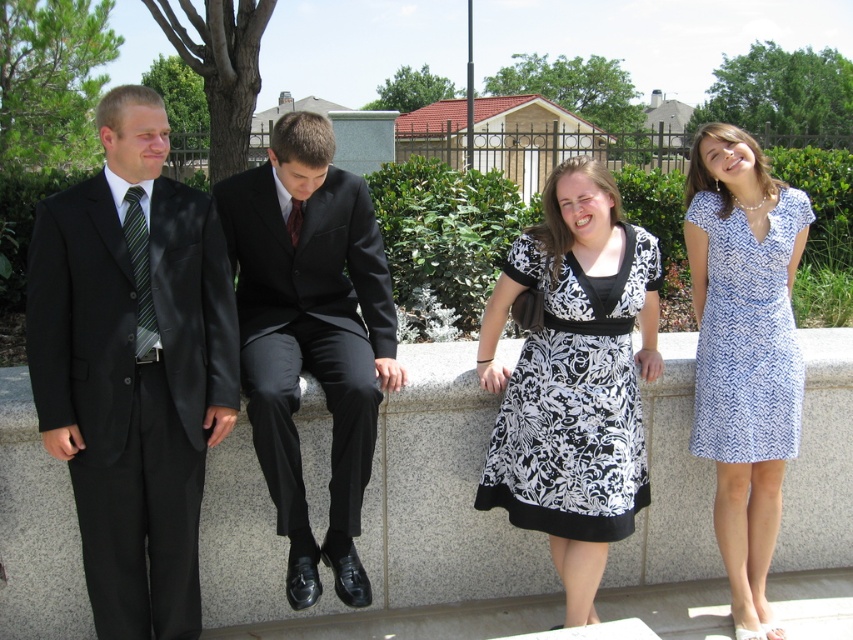
From the picture: Does blue zigzag-patterned dress at right appear on the left side of black silk tie at center?

In fact, blue zigzag-patterned dress at right is to the right of black silk tie at center.

From the picture: Does blue zigzag-patterned dress at right appear under black silk tie at center?

Indeed, blue zigzag-patterned dress at right is positioned under black silk tie at center.

At what (x,y) coordinates should I click in order to perform the action: click on blue zigzag-patterned dress at right. Please return your answer as a coordinate pair (x, y). This screenshot has height=640, width=853. Looking at the image, I should click on pyautogui.click(x=747, y=333).

Does green striped tie at left appear on the left side of black silk tie at center?

Correct, you'll find green striped tie at left to the left of black silk tie at center.

Looking at this image, who is higher up, green striped tie at left or black silk tie at center?

Positioned higher is black silk tie at center.

Locate an element on the screen. This screenshot has width=853, height=640. green striped tie at left is located at coordinates (140, 269).

Does point (579, 440) come in front of point (297, 218)?

That is True.

Does black damask dress at center have a greater width compared to black silk tie at center?

Correct, the width of black damask dress at center exceeds that of black silk tie at center.

What do you see at coordinates (573, 397) in the screenshot?
I see `black damask dress at center` at bounding box center [573, 397].

Where is `black damask dress at center`? black damask dress at center is located at coordinates click(x=573, y=397).